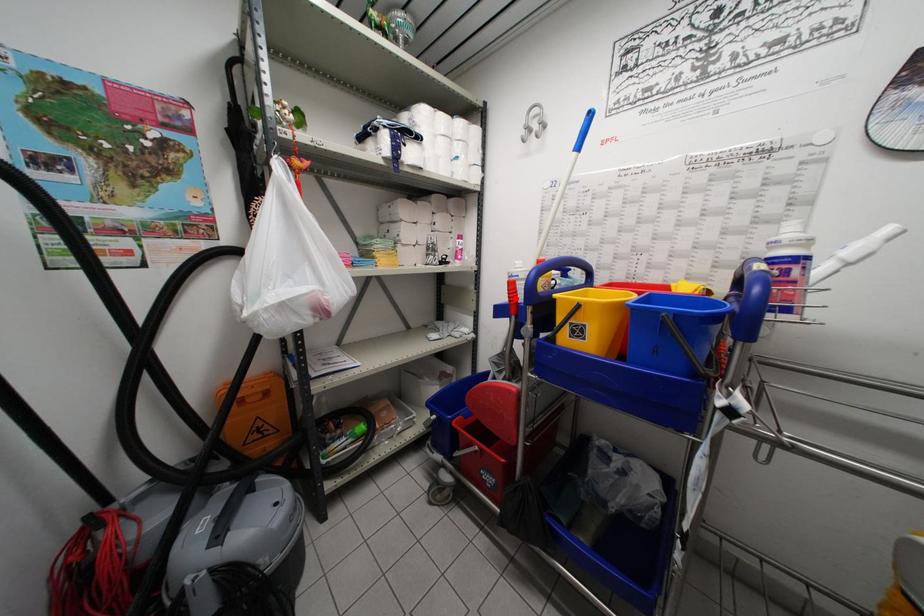
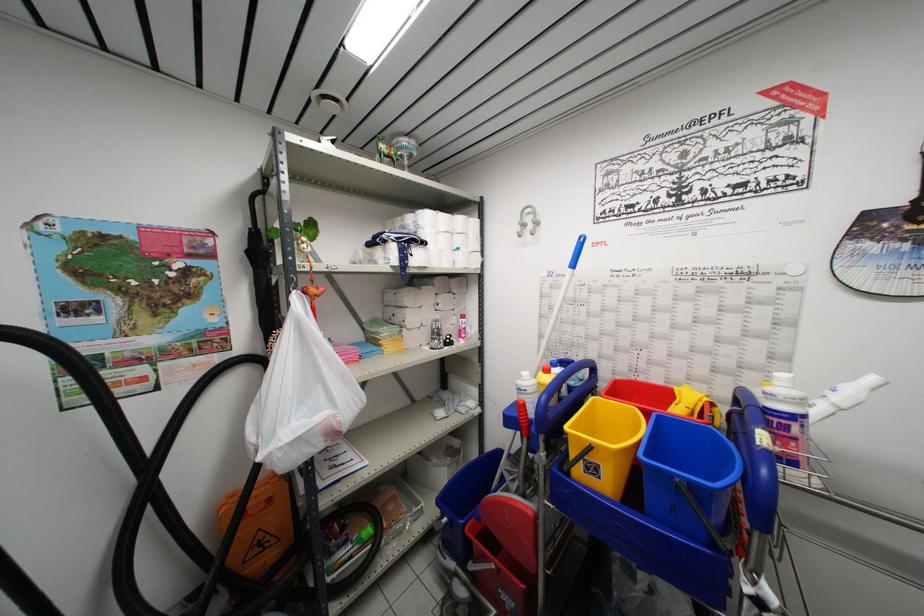
Locate, in the second image, the point that corresponds to the highlighted location in the first image.

(526, 421)